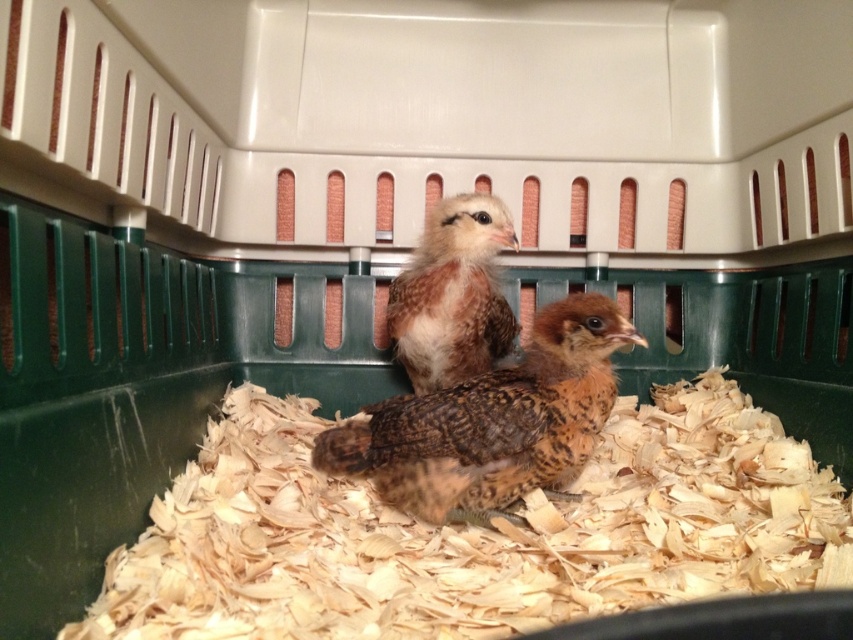
In the image of the chicks in the container, there are two objects labeled as brown speckled feathers at center and brown speckled feather at center. Which of these two objects is positioned to the right side?

The brown speckled feathers at center is positioned to the right of the brown speckled feather at center.

Based on the photo, you are a farmer checking on your baby chicks in their container. You notice a specific point marked at coordinates (492, 422). What object is located at that point?

The point at coordinates (492, 422) indicates the location of the brown speckled feathers at center.

You are a farmer checking on the chicks in the container. You notice two points marked in the image. Which point is closer to you, point (582, 433) or point (502, 234)?

Point (582, 433) is closer to the viewer than point (502, 234).